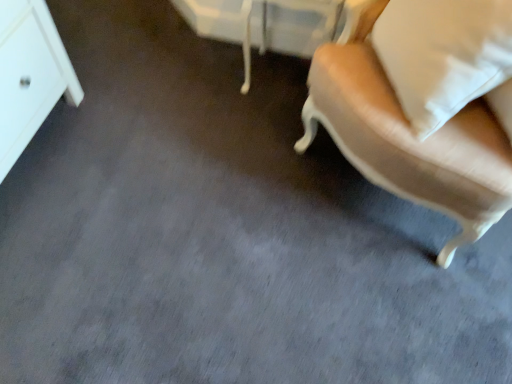
Describe the element at coordinates (447, 58) in the screenshot. I see `white soft pillow at upper right` at that location.

Locate an element on the screen. beige fabric chair at right is located at coordinates (407, 135).

The width and height of the screenshot is (512, 384). I want to click on white soft pillow at upper right, so click(x=447, y=58).

Looking at their sizes, would you say beige fabric chair at right is wider or thinner than white glossy vanity at upper center?

In the image, beige fabric chair at right appears to be wider than white glossy vanity at upper center.

Considering the positions of point (333, 99) and point (239, 11), is point (333, 99) closer or farther from the camera than point (239, 11)?

Clearly, point (333, 99) is closer to the camera than point (239, 11).

From the image's perspective, between beige fabric chair at right and white glossy vanity at upper center, which one is located above?

white glossy vanity at upper center, from the image's perspective.

Considering the sizes of beige fabric chair at right and white glossy vanity at upper center in the image, is beige fabric chair at right taller or shorter than white glossy vanity at upper center?

beige fabric chair at right is taller than white glossy vanity at upper center.

Is white soft pillow at upper right taller or shorter than white glossy vanity at upper center?

In the image, white soft pillow at upper right appears to be shorter than white glossy vanity at upper center.

Looking at this image, considering the relative sizes of white soft pillow at upper right and white glossy vanity at upper center in the image provided, is white soft pillow at upper right smaller than white glossy vanity at upper center?

No.

How far apart are white soft pillow at upper right and white glossy vanity at upper center?

white soft pillow at upper right and white glossy vanity at upper center are 31.58 inches apart.

Which is correct: white soft pillow at upper right is inside white glossy vanity at upper center, or outside of it?

white soft pillow at upper right cannot be found inside white glossy vanity at upper center.

From a real-world perspective, is white glossy vanity at upper center beneath white soft pillow at upper right?

Yes, from a real-world perspective, white glossy vanity at upper center is beneath white soft pillow at upper right.

Is white glossy vanity at upper center facing away from white soft pillow at upper right?

white glossy vanity at upper center does not have its back to white soft pillow at upper right.

Is white soft pillow at upper right located within white glossy vanity at upper center?

Actually, white soft pillow at upper right is outside white glossy vanity at upper center.

Identify the location of pillow in front of the white glossy vanity at upper center. (447, 58).

Does point (203, 32) come closer to viewer compared to point (433, 138)?

No, (203, 32) is further to viewer.

Looking at their sizes, would you say white glossy vanity at upper center is wider or thinner than beige fabric chair at right?

Clearly, white glossy vanity at upper center has less width compared to beige fabric chair at right.

Find the location of a particular element. This screenshot has width=512, height=384. chair below the white glossy vanity at upper center (from the image's perspective) is located at coordinates (407, 135).

Which object is closer to the camera, white glossy vanity at upper center or beige fabric chair at right?

beige fabric chair at right.

From the image's perspective, does beige fabric chair at right appear lower than white soft pillow at upper right?

Actually, beige fabric chair at right appears above white soft pillow at upper right in the image.

Is beige fabric chair at right turned away from white soft pillow at upper right?

Yes, beige fabric chair at right is facing away from white soft pillow at upper right.

Locate an element on the screen. The height and width of the screenshot is (384, 512). chair on the left of white soft pillow at upper right is located at coordinates (407, 135).

From a real-world perspective, which is physically above, white soft pillow at upper right or beige fabric chair at right?

white soft pillow at upper right is physically above.

Is white soft pillow at upper right far away from beige fabric chair at right?

white soft pillow at upper right is actually quite close to beige fabric chair at right.

Which is behind, white soft pillow at upper right or beige fabric chair at right?

white soft pillow at upper right.

Can you confirm if white soft pillow at upper right is shorter than beige fabric chair at right?

Yes, white soft pillow at upper right is shorter than beige fabric chair at right.

Where is `chair above the white glossy vanity at upper center (from a real-world perspective)`? The height and width of the screenshot is (384, 512). chair above the white glossy vanity at upper center (from a real-world perspective) is located at coordinates (407, 135).

Locate an element on the screen. Image resolution: width=512 pixels, height=384 pixels. pillow on the right of white glossy vanity at upper center is located at coordinates (447, 58).

From the image, which object appears to be farther from beige fabric chair at right, white glossy vanity at upper center or white soft pillow at upper right?

white glossy vanity at upper center lies further to beige fabric chair at right than the other object.

Which object lies further to the anchor point white soft pillow at upper right, white glossy vanity at upper center or beige fabric chair at right?

white glossy vanity at upper center lies further to white soft pillow at upper right than the other object.

From the image, which object appears to be farther from white glossy vanity at upper center, white soft pillow at upper right or beige fabric chair at right?

white soft pillow at upper right lies further to white glossy vanity at upper center than the other object.

Based on their spatial positions, is beige fabric chair at right or white glossy vanity at upper center closer to white soft pillow at upper right?

beige fabric chair at right is positioned closer to the anchor white soft pillow at upper right.

Which object lies further to the anchor point white glossy vanity at upper center, beige fabric chair at right or white soft pillow at upper right?

The object further to white glossy vanity at upper center is white soft pillow at upper right.

Based on their spatial positions, is white soft pillow at upper right or white glossy vanity at upper center further from beige fabric chair at right?

Among the two, white glossy vanity at upper center is located further to beige fabric chair at right.

Locate an element on the screen. The width and height of the screenshot is (512, 384). pillow located between beige fabric chair at right and white glossy vanity at upper center in the depth direction is located at coordinates (447, 58).